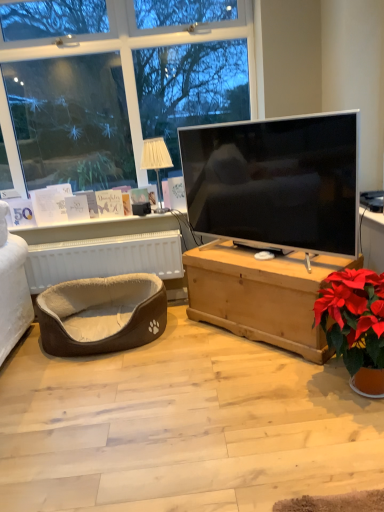
Question: Does white fabric lampshade at upper center have a greater width compared to matte black tv at center?

Choices:
 (A) no
 (B) yes

Answer: (B)

Question: From a real-world perspective, is white fabric lampshade at upper center positioned under matte black tv at center based on gravity?

Choices:
 (A) yes
 (B) no

Answer: (B)

Question: From the image's perspective, is white fabric lampshade at upper center below matte black tv at center?

Choices:
 (A) no
 (B) yes

Answer: (A)

Question: Could you tell me if white fabric lampshade at upper center is turned towards matte black tv at center?

Choices:
 (A) no
 (B) yes

Answer: (A)

Question: Is white fabric lampshade at upper center shorter than matte black tv at center?

Choices:
 (A) no
 (B) yes

Answer: (B)

Question: In terms of height, does light brown wooden chest at center look taller or shorter compared to brown plush pet bed at lower left?

Choices:
 (A) short
 (B) tall

Answer: (B)

Question: Looking at their shapes, would you say light brown wooden chest at center is wider or thinner than brown plush pet bed at lower left?

Choices:
 (A) wide
 (B) thin

Answer: (B)

Question: Relative to brown plush pet bed at lower left, is light brown wooden chest at center in front or behind?

Choices:
 (A) front
 (B) behind

Answer: (A)

Question: Which is correct: light brown wooden chest at center is inside brown plush pet bed at lower left, or outside of it?

Choices:
 (A) outside
 (B) inside

Answer: (A)

Question: Considering the positions of matte black tv at center and white fabric lampshade at upper center in the image, is matte black tv at center wider or thinner than white fabric lampshade at upper center?

Choices:
 (A) thin
 (B) wide

Answer: (A)

Question: Does point 254,198 appear closer or farther from the camera than point 157,186?

Choices:
 (A) closer
 (B) farther

Answer: (A)

Question: From the image's perspective, is matte black tv at center located above or below white fabric lampshade at upper center?

Choices:
 (A) above
 (B) below

Answer: (B)

Question: Relative to white fabric lampshade at upper center, is matte black tv at center in front or behind?

Choices:
 (A) behind
 (B) front

Answer: (B)

Question: In terms of size, does white fabric lampshade at upper center appear bigger or smaller than matte black tv at center?

Choices:
 (A) small
 (B) big

Answer: (A)

Question: Would you say white fabric lampshade at upper center is to the left or to the right of matte black tv at center in the picture?

Choices:
 (A) right
 (B) left

Answer: (B)